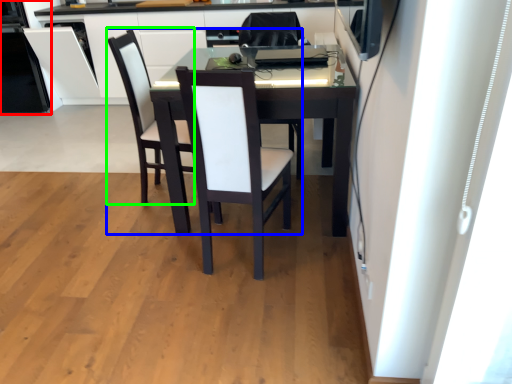
Question: Which object is positioned closest to appliance (highlighted by a red box)? Select from chair (highlighted by a blue box) and armchair (highlighted by a green box).

Choices:
 (A) chair
 (B) armchair

Answer: (B)